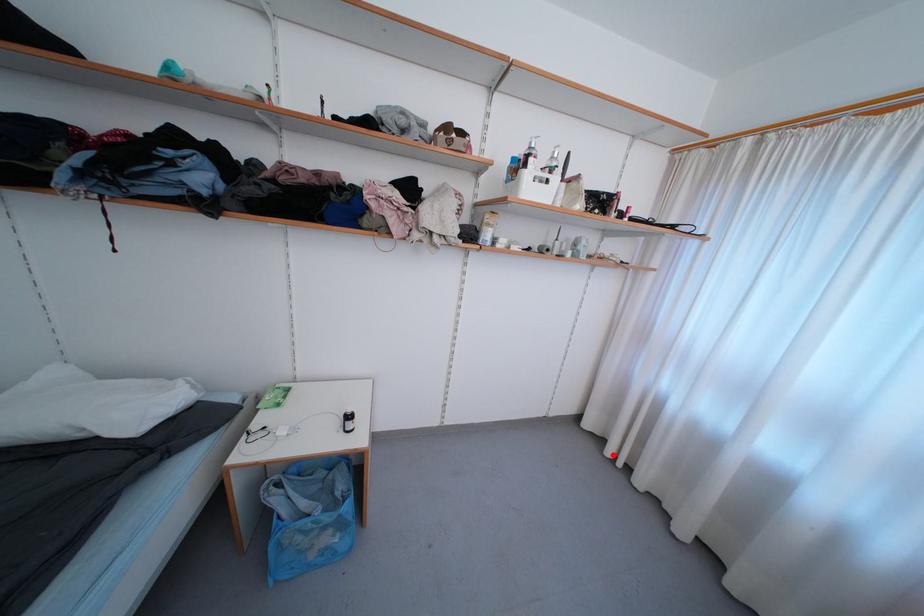
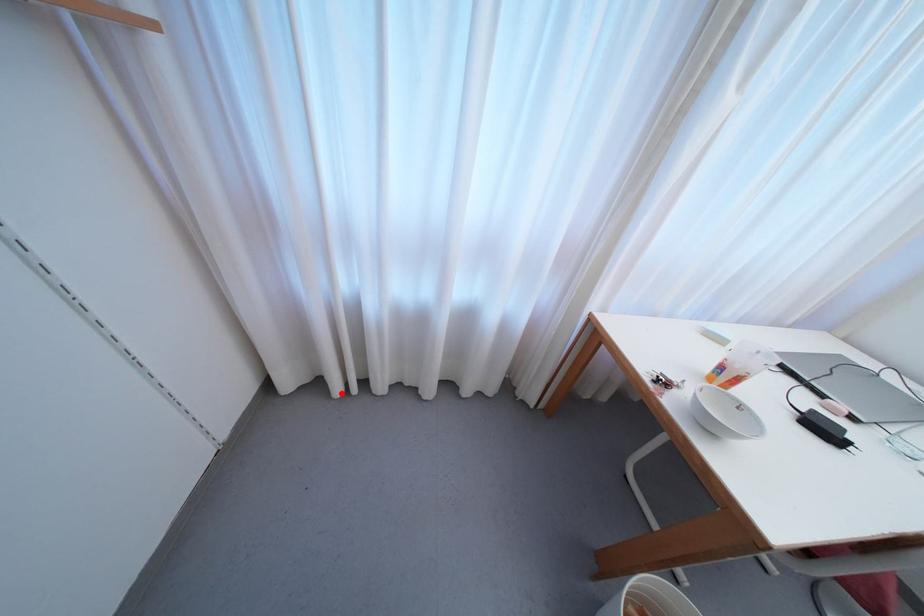
I am providing you with two images of the same scene from different viewpoints. A red point is marked on the first image and another point is marked on the second image. Is the marked point in image1 the same physical position as the marked point in image2?

Yes